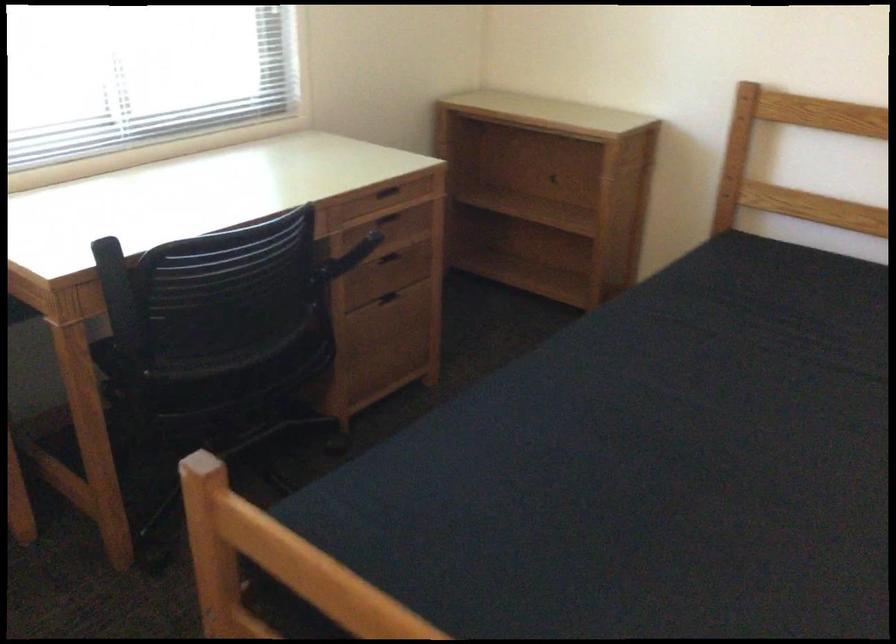
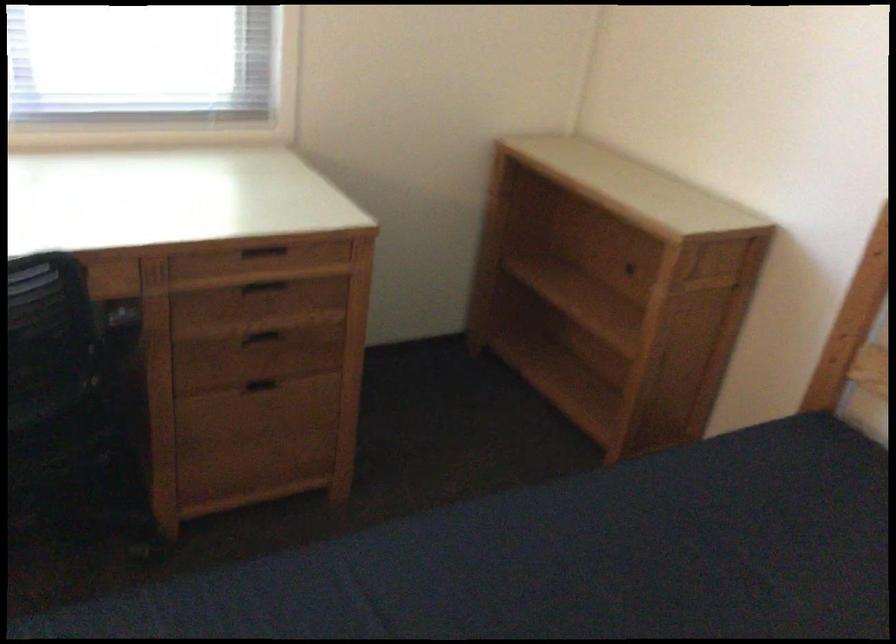
Where in the second image is the point corresponding to point (383, 196) from the first image?

(263, 252)